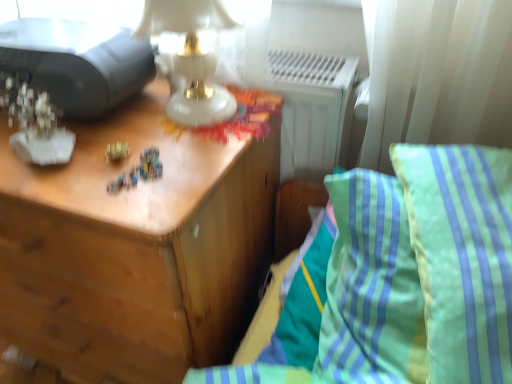
Identify the location of vacant space in front of gold metallic toy at center. This screenshot has width=512, height=384. (110, 194).